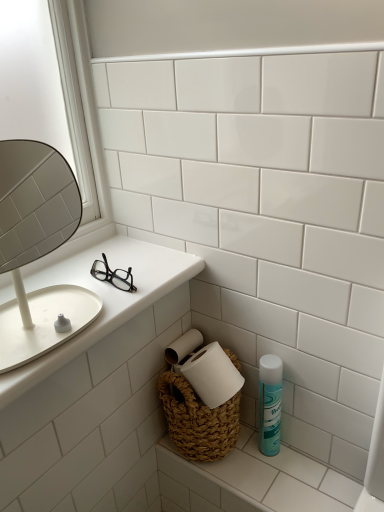
At what (x,y) coordinates should I click in order to perform the action: click on vacant region in front of teal matte mouthwash at lower right. Please return your answer as a coordinate pair (x, y). The image size is (384, 512). Looking at the image, I should click on (286, 481).